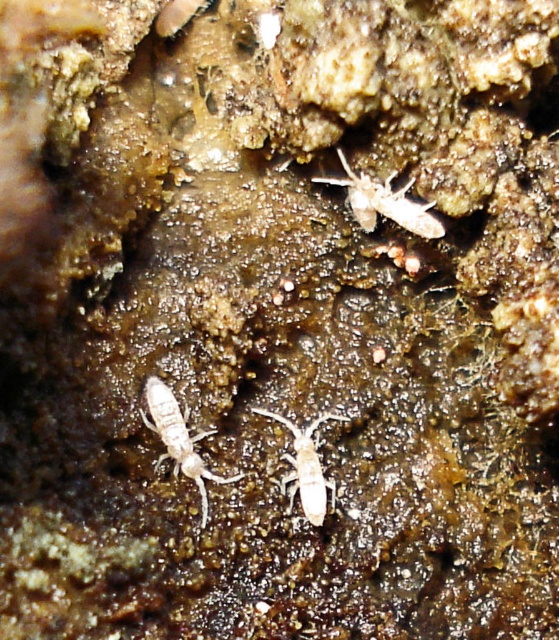
At what (x,y) coordinates should I click in order to perform the action: click on translucent white insect at upper right. Please return your answer as a coordinate pair (x, y). This screenshot has height=640, width=559. Looking at the image, I should click on (385, 202).

Between translucent white insect at upper right and white matte insect at center, which one appears on the left side from the viewer's perspective?

white matte insect at center

Between point (369, 228) and point (310, 461), which one is positioned in front?

Positioned in front is point (310, 461).

Identify the location of translucent white insect at upper right. This screenshot has width=559, height=640. (385, 202).

Identify the location of white matte insect at lower left. The height and width of the screenshot is (640, 559). (178, 438).